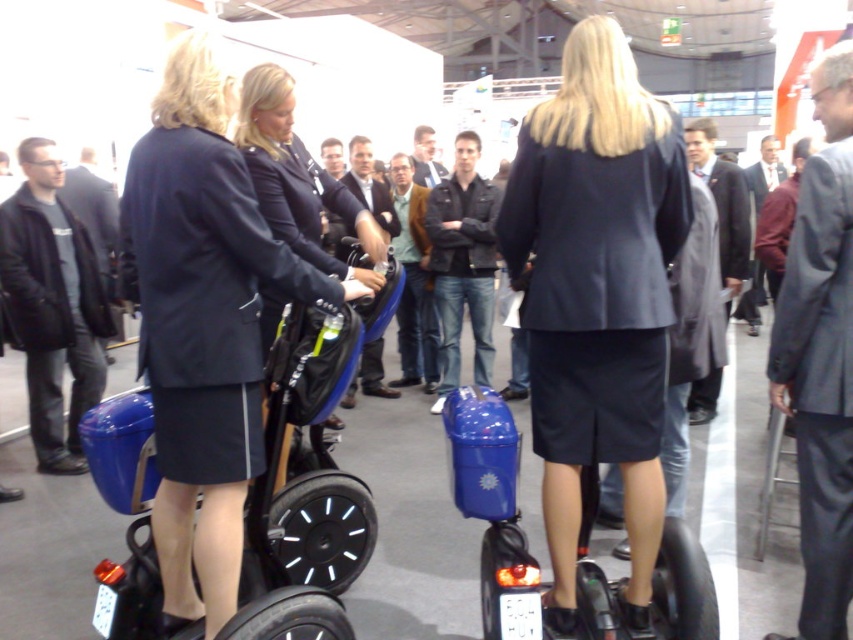
Question: Which point is farther to the camera?

Choices:
 (A) (695, 628)
 (B) (24, 330)

Answer: (B)

Question: Which of the following is the closest to the observer?

Choices:
 (A) (45, 385)
 (B) (653, 604)
 (C) (547, 99)

Answer: (C)

Question: From the image, what is the correct spatial relationship of matte black suit at center in relation to matte black jacket at center?

Choices:
 (A) above
 (B) below

Answer: (B)

Question: Among these objects, which one is farthest from the camera?

Choices:
 (A) matte black jacket at center
 (B) blue matte scooter at center
 (C) gray wool coat at center
 (D) matte black suit at center

Answer: (C)

Question: Is blue matte scooter at center below gray wool coat at center?

Choices:
 (A) yes
 (B) no

Answer: (A)

Question: Can you confirm if matte black suit at center is bigger than gray wool coat at center?

Choices:
 (A) yes
 (B) no

Answer: (B)